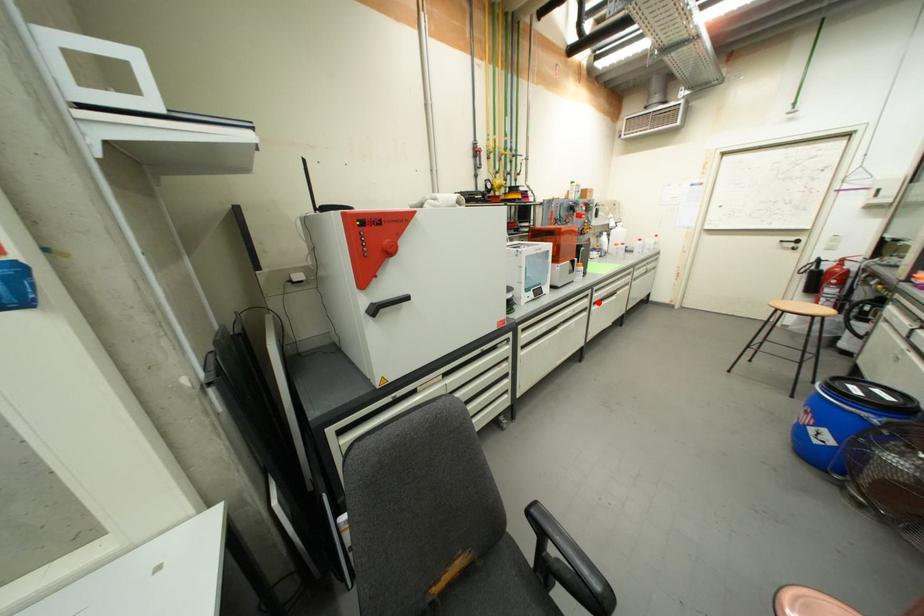
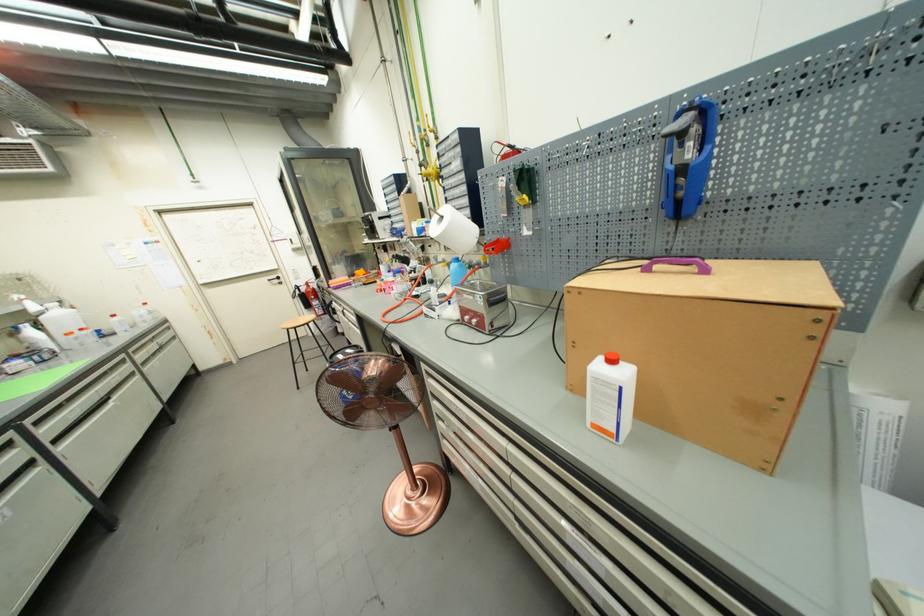
Question: I am providing you with two images of the same scene from different viewpoints. Image1 has a red point marked. In image2, the corresponding 3D location appears at what relative position? Reply with the corresponding letter.

Choices:
 (A) Closer
 (B) Farther

Answer: (B)